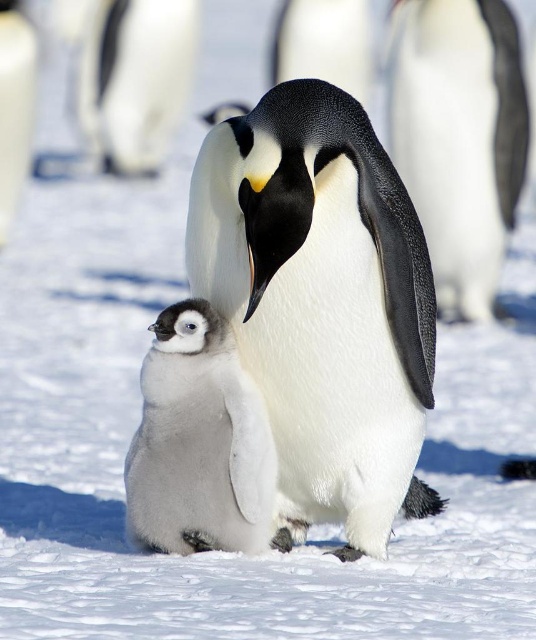
Is point (172, 106) in front of point (0, 32)?

No.

Who is taller, white fluffy penguin at upper left or white fluffy penguin chick at left?

With more height is white fluffy penguin chick at left.

Who is more forward, (153, 108) or (35, 49)?

A: Point (35, 49) is more forward.

This screenshot has height=640, width=536. In order to click on white fluffy penguin at upper left in this screenshot , I will do `click(137, 77)`.

Between point (471, 292) and point (5, 26), which one is positioned in front?

Positioned in front is point (471, 292).

In the scene shown: Does white matte penguin at upper right have a lesser width compared to white fluffy penguin chick at left?

In fact, white matte penguin at upper right might be wider than white fluffy penguin chick at left.

Who is more forward, (442,172) or (13,93)?

Positioned in front is point (442,172).

You are a GUI agent. You are given a task and a screenshot of the screen. Output one action in this format:
    pyautogui.click(x=<x>, y=<y>)
    Task: Click on the white matte penguin at upper right
    The height and width of the screenshot is (640, 536).
    Given the screenshot: What is the action you would take?
    pyautogui.click(x=459, y=138)

Does point (453, 38) come farther from viewer compared to point (182, 33)?

No, it is in front of (182, 33).

Find the location of a particular element. white matte penguin at upper right is located at coordinates (459, 138).